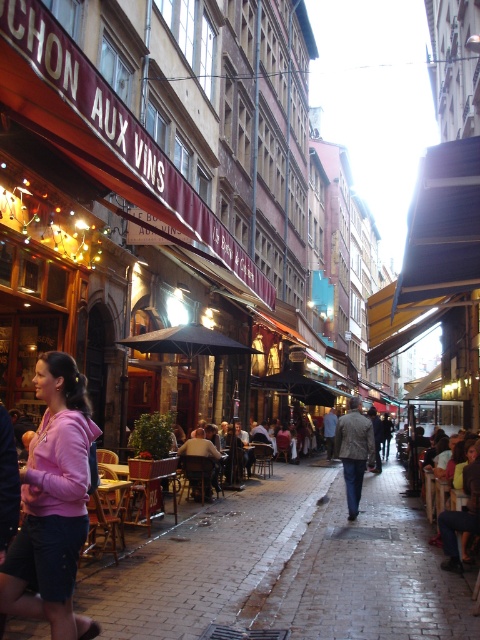
You are a tourist walking down the street and notice both the brick pavement at center and the pink fleece jacket at center. Which object is located to the right of the other?

The brick pavement at center is positioned on the right side of pink fleece jacket at center.

You are a tourist standing in the middle of the street in the European city scene. You notice a pink fleece jacket at center and brick pavement at center. Where is the pink fleece jacket located relative to the brick pavement?

The pink fleece jacket at center is above the brick pavement at center.